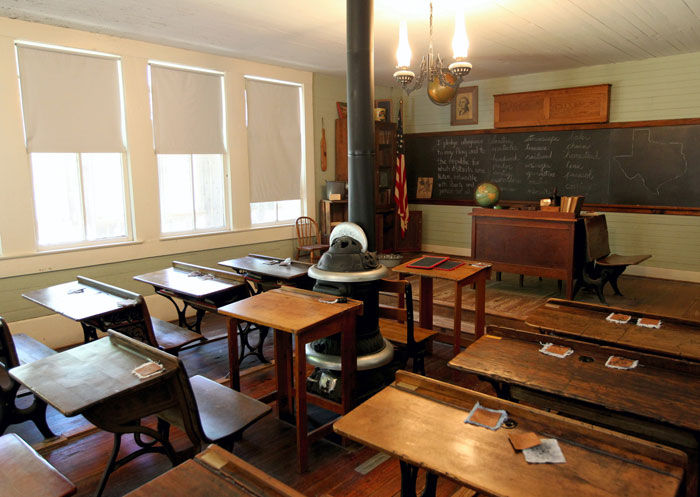
Identify the location of picture. (466, 112).